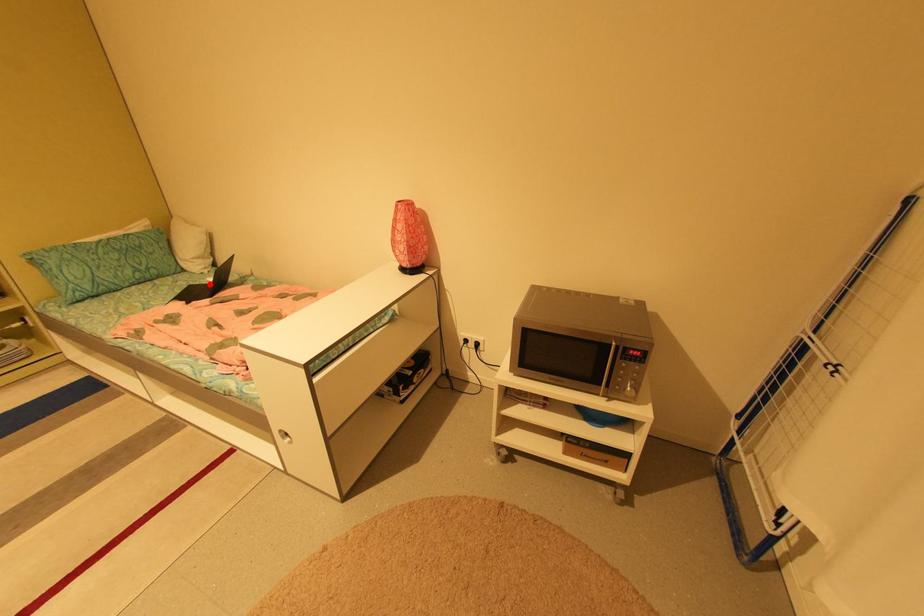
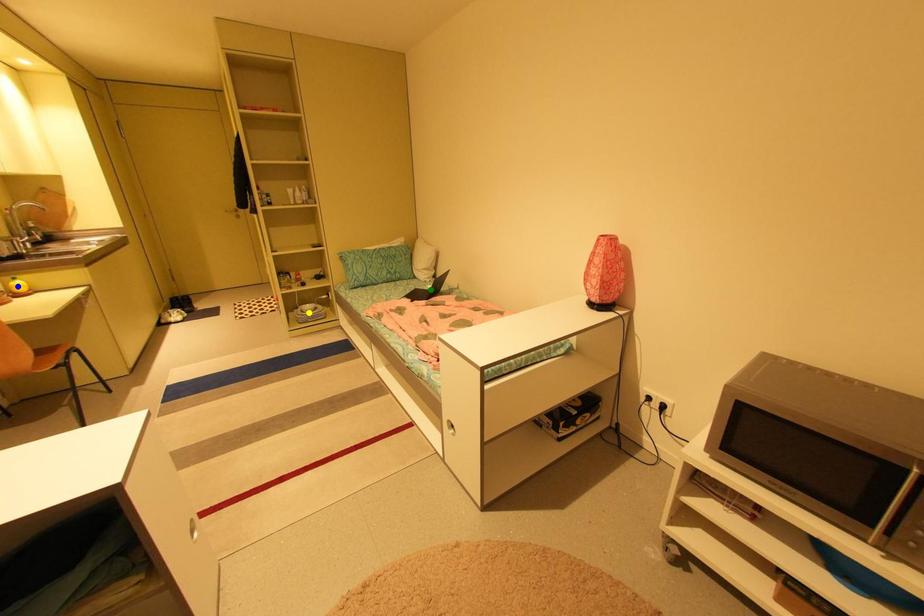
Question: I am providing you with two images of the same scene from different viewpoints. A red point is marked on the first image. You are given multiple points on the second image. Can you choose the point in image 2 that corresponds to the point in image 1?

Choices:
 (A) green point
 (B) blue point
 (C) yellow point

Answer: (A)